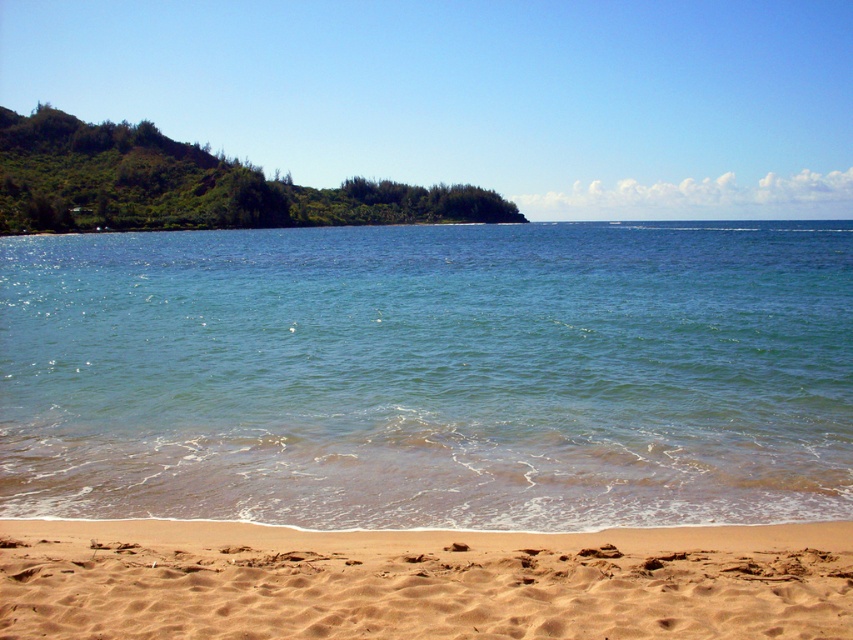
Does point (599, 312) come farther from viewer compared to point (56, 529)?

Yes, it is behind point (56, 529).

Which is below, clear blue water at center or brown sandy beach at lower center?

brown sandy beach at lower center is below.

Is point (311, 525) less distant than point (720, 566)?

No, (311, 525) is further to viewer.

The width and height of the screenshot is (853, 640). What are the coordinates of `clear blue water at center` in the screenshot? It's located at (x=430, y=374).